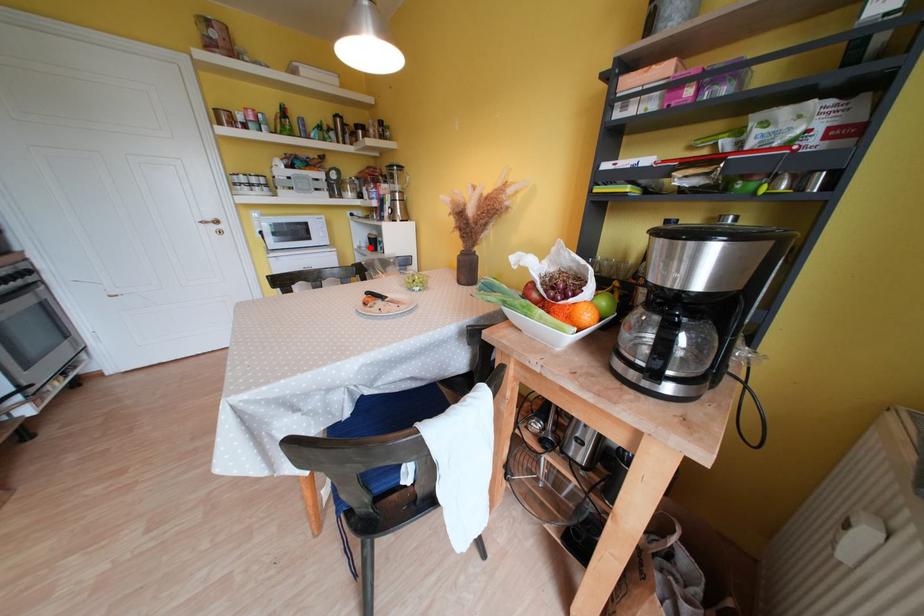
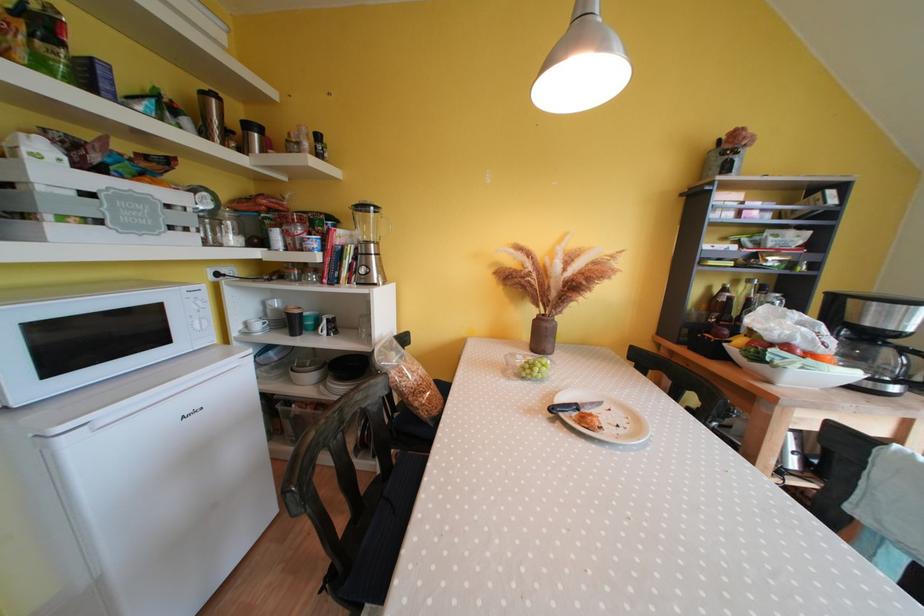
Locate, in the second image, the point that corresponds to the highlighted location in the first image.

(264, 330)